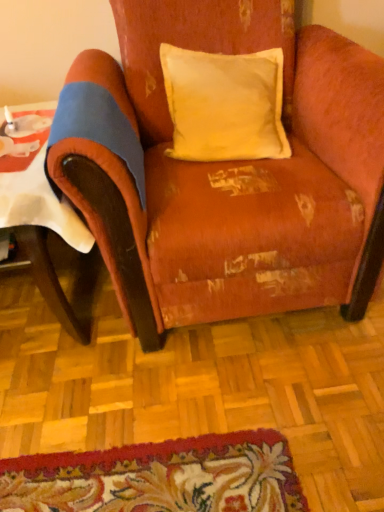
Question: Is white paper at left outside worn velvet armchair at center?

Choices:
 (A) yes
 (B) no

Answer: (A)

Question: Does white paper at left lie behind worn velvet armchair at center?

Choices:
 (A) no
 (B) yes

Answer: (B)

Question: From a real-world perspective, is white paper at left located beneath worn velvet armchair at center?

Choices:
 (A) yes
 (B) no

Answer: (A)

Question: Is worn velvet armchair at center a part of white paper at left?

Choices:
 (A) yes
 (B) no

Answer: (B)

Question: Is white paper at left at the right side of worn velvet armchair at center?

Choices:
 (A) yes
 (B) no

Answer: (B)

Question: Based on their sizes in the image, would you say white paper at left is bigger or smaller than yellow velvet pillow at upper center?

Choices:
 (A) small
 (B) big

Answer: (B)

Question: Is point (49, 104) positioned closer to the camera than point (253, 81)?

Choices:
 (A) closer
 (B) farther

Answer: (B)

Question: Is white paper at left taller or shorter than yellow velvet pillow at upper center?

Choices:
 (A) tall
 (B) short

Answer: (B)

Question: Considering their positions, is white paper at left located in front of or behind yellow velvet pillow at upper center?

Choices:
 (A) front
 (B) behind

Answer: (A)

Question: In terms of height, does worn velvet armchair at center look taller or shorter compared to white paper at left?

Choices:
 (A) tall
 (B) short

Answer: (A)

Question: Is worn velvet armchair at center in front of or behind white paper at left in the image?

Choices:
 (A) front
 (B) behind

Answer: (A)

Question: Visually, is worn velvet armchair at center positioned to the left or to the right of white paper at left?

Choices:
 (A) right
 (B) left

Answer: (A)

Question: Looking at their shapes, would you say worn velvet armchair at center is wider or thinner than white paper at left?

Choices:
 (A) thin
 (B) wide

Answer: (B)

Question: From the image's perspective, is white paper at left positioned above or below worn velvet armchair at center?

Choices:
 (A) below
 (B) above

Answer: (A)

Question: Based on their positions, is white paper at left located to the left or right of worn velvet armchair at center?

Choices:
 (A) left
 (B) right

Answer: (A)